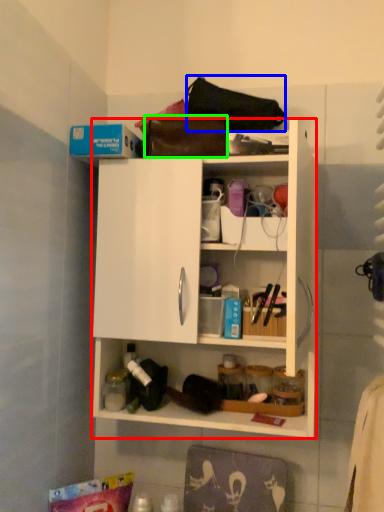
Question: Considering the real-world distances, which object is farthest from cabinetry (highlighted by a red box)? handbag (highlighted by a blue box) or handbag (highlighted by a green box)?

Choices:
 (A) handbag
 (B) handbag

Answer: (A)